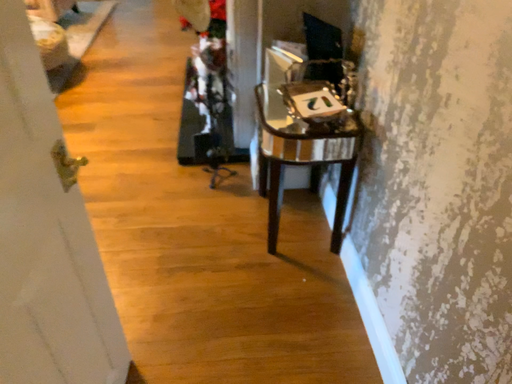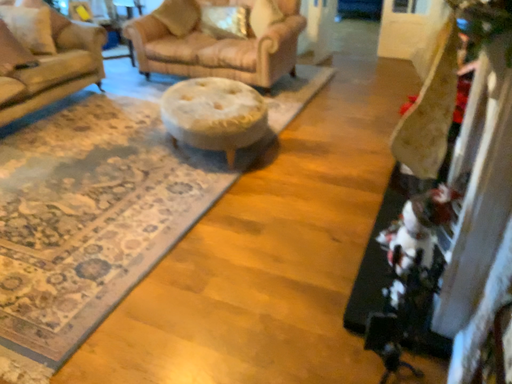
Question: How did the camera likely rotate when shooting the video?

Choices:
 (A) rotated right
 (B) rotated left

Answer: (B)